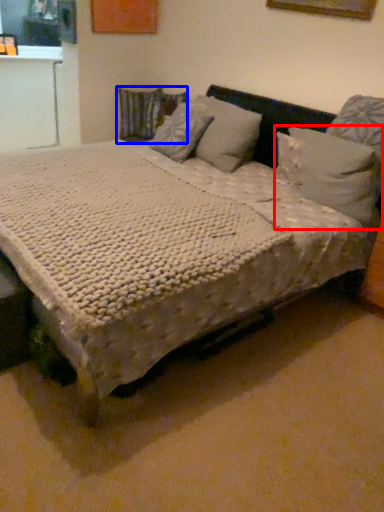
Question: Which object appears farthest to the camera in this image, pillow (highlighted by a red box) or pillow (highlighted by a blue box)?

Choices:
 (A) pillow
 (B) pillow

Answer: (B)